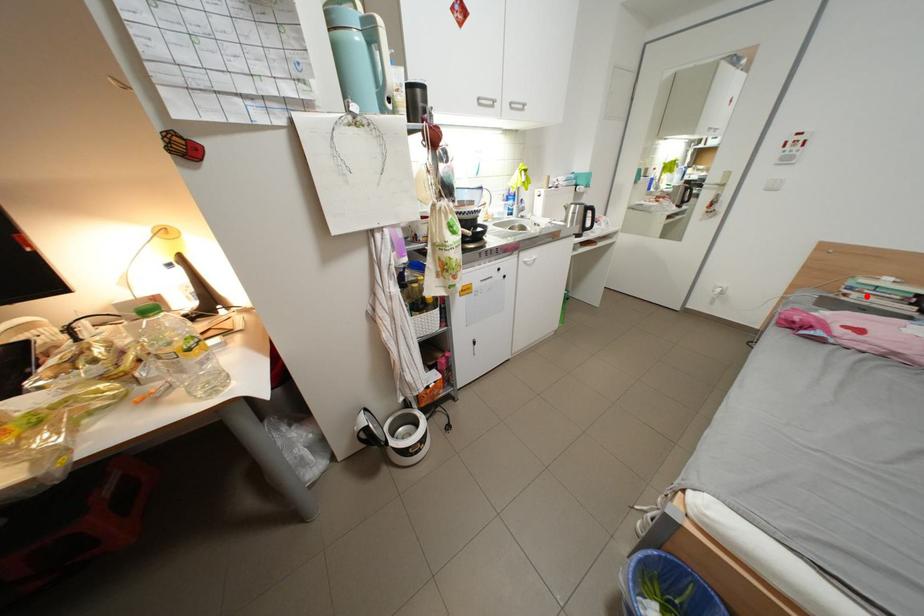
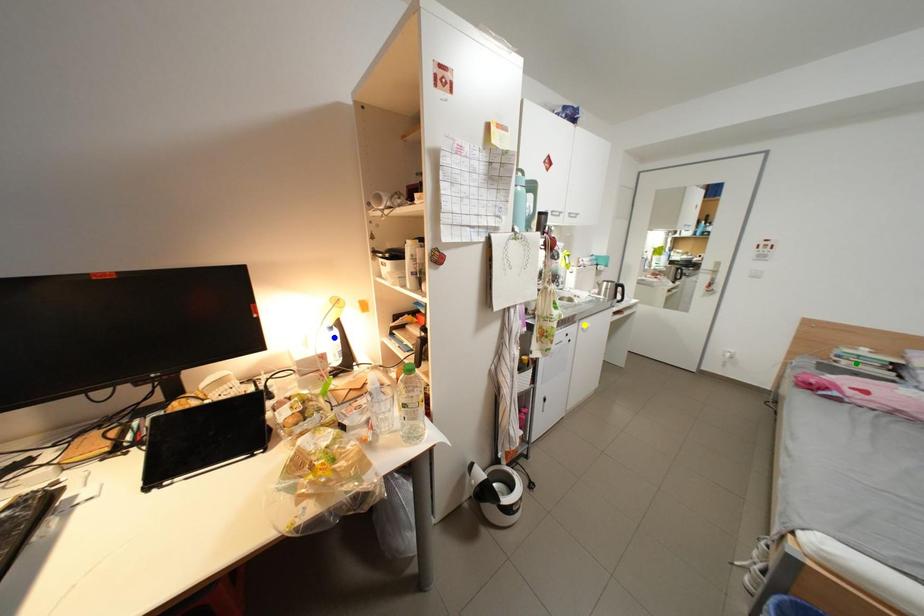
Question: I am providing you with two images of the same scene from different viewpoints. A red point is marked on the first image. You are given multiple points on the second image. In image 2, which mark is for the same physical point as the one in image 1?

Choices:
 (A) green point
 (B) yellow point
 (C) blue point

Answer: (A)